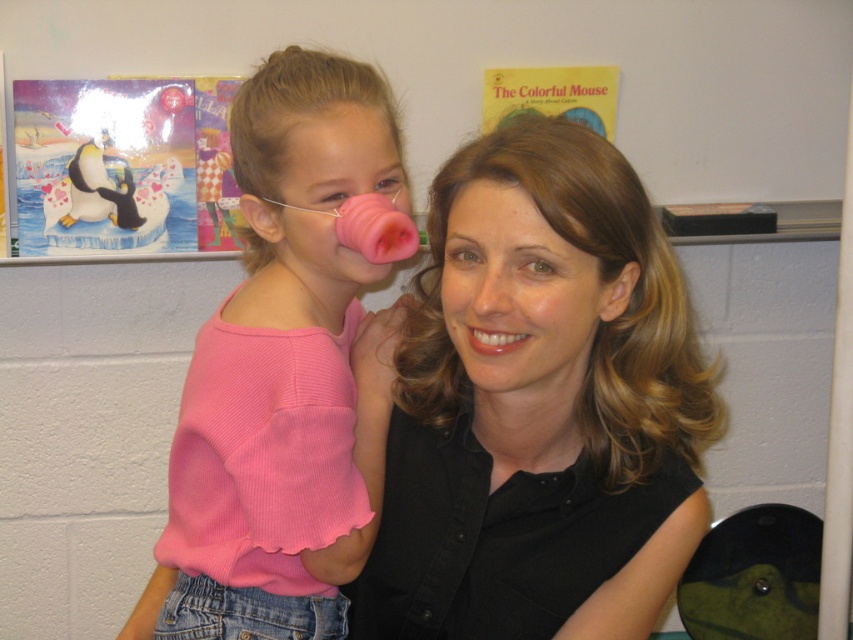
Question: Among these points, which one is farthest from the camera?

Choices:
 (A) (129, 195)
 (B) (474, 451)
 (C) (190, 589)

Answer: (A)

Question: Is black matte shirt at center to the right of pink ribbed sweater at center from the viewer's perspective?

Choices:
 (A) yes
 (B) no

Answer: (A)

Question: Which object appears closest to the camera in this image?

Choices:
 (A) white matte penguin at upper left
 (B) pink ribbed sweater at center

Answer: (B)

Question: Does black matte shirt at center have a larger size compared to white matte penguin at upper left?

Choices:
 (A) yes
 (B) no

Answer: (A)

Question: Does black matte shirt at center have a smaller size compared to pink ribbed sweater at center?

Choices:
 (A) no
 (B) yes

Answer: (A)

Question: Among these points, which one is farthest from the camera?

Choices:
 (A) (647, 596)
 (B) (251, 483)
 (C) (90, 166)

Answer: (C)